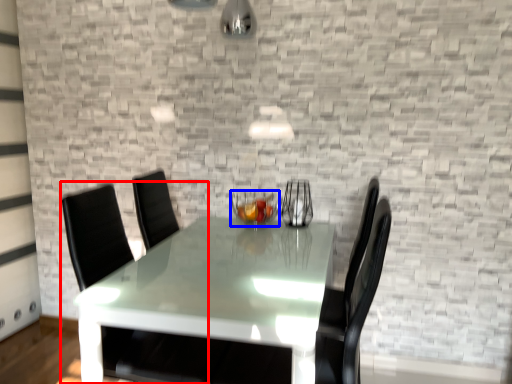
Question: Among these objects, which one is farthest to the camera, swivel chair (highlighted by a red box) or candle holder (highlighted by a blue box)?

Choices:
 (A) swivel chair
 (B) candle holder

Answer: (B)